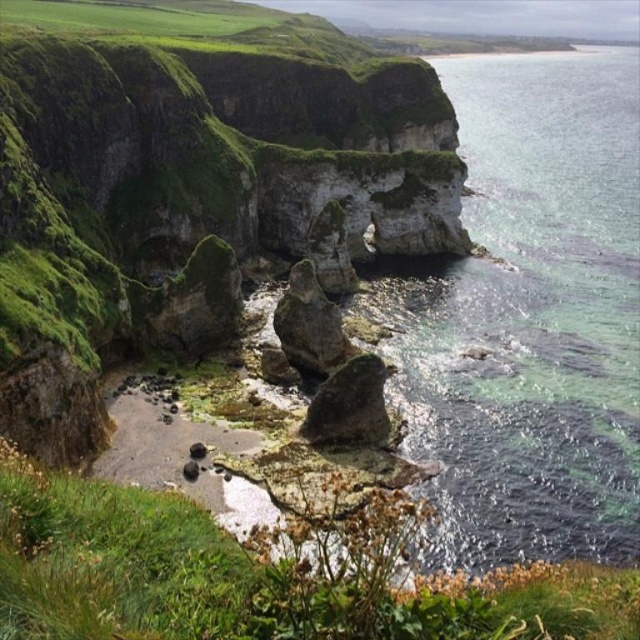
You are a hiker standing at the edge of the cliff. You see the green mossy rock formation at center and the clear water at lower right. Which one is shorter?

The green mossy rock formation at center is shorter than the clear water at lower right.

Looking at this image, you are a geologist examining the coastal cliffs. You notice the green mossy rock formation at center and the rough textured rock at center. Which of these two rocks is higher up in elevation?

The green mossy rock formation at center is taller than the rough textured rock at center, so it is higher in elevation.